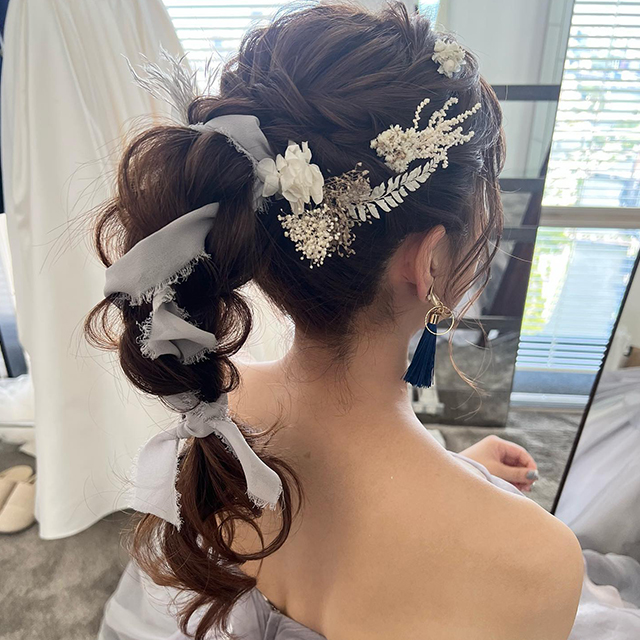
I want to click on window, so click(202, 19), click(587, 88).